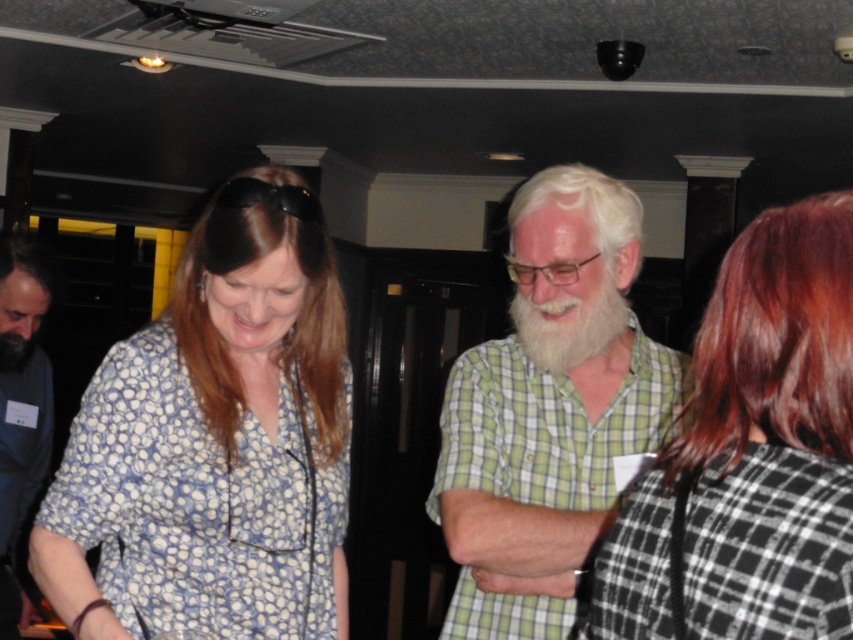
You are at a party and want to approach the person wearing the black and white checkered shirt at upper right and the person with brown smooth hair at center. Which one should you walk towards first if you want to greet them both starting from the entrance?

You should greet the black and white checkered shirt at upper right first because it is closer to you than the brown smooth hair at center, so you can reach them first before moving further into the room.

You are standing at the point labeled point (x=10, y=237) in the scene. If you turn around completely, will the point labeled point (x=48, y=269) come into your view?

Yes, because point (x=48, y=269) is behind point (x=10, y=237), so turning around would allow you to see it.